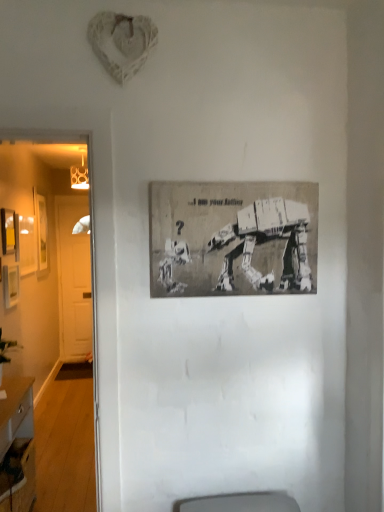
Question: Is gray paper poster at center, the 4th picture frame positioned from the back, at the left side of wooden picture frame at left, arranged as the 4th picture frame when viewed from the right?

Choices:
 (A) yes
 (B) no

Answer: (B)

Question: Is gray paper poster at center, acting as the 1th picture frame starting from the right, oriented towards wooden picture frame at left, marked as the first picture frame in a back-to-front arrangement?

Choices:
 (A) yes
 (B) no

Answer: (B)

Question: Is gray paper poster at center, the 4th picture frame positioned from the back, shorter than wooden picture frame at left, arranged as the 4th picture frame when viewed from the right?

Choices:
 (A) no
 (B) yes

Answer: (B)

Question: Considering the relative sizes of gray paper poster at center, acting as the 1th picture frame starting from the right, and wooden picture frame at left, the first picture frame positioned from the left, in the image provided, is gray paper poster at center, acting as the 1th picture frame starting from the right, thinner than wooden picture frame at left, the first picture frame positioned from the left,?

Choices:
 (A) yes
 (B) no

Answer: (B)

Question: Considering the relative sizes of gray paper poster at center, the 4th picture frame positioned from the back, and wooden picture frame at left, the first picture frame positioned from the left, in the image provided, is gray paper poster at center, the 4th picture frame positioned from the back, smaller than wooden picture frame at left, the first picture frame positioned from the left,?

Choices:
 (A) yes
 (B) no

Answer: (A)

Question: From the image's perspective, is wooden picture frame at left, the 3th picture frame positioned from the front, above or below matte yellow picture frame at left, the 2th picture frame from the left?

Choices:
 (A) above
 (B) below

Answer: (B)

Question: In terms of height, does wooden picture frame at left, the 2th picture frame in the right-to-left sequence, look taller or shorter compared to matte yellow picture frame at left, the 2th picture frame from the left?

Choices:
 (A) tall
 (B) short

Answer: (B)

Question: Is point (14, 288) positioned closer to the camera than point (13, 250)?

Choices:
 (A) farther
 (B) closer

Answer: (B)

Question: Considering the positions of wooden picture frame at left, the 3th picture frame positioned from the front, and matte yellow picture frame at left, which appears as the 2th picture frame when viewed from the front, in the image, is wooden picture frame at left, the 3th picture frame positioned from the front, bigger or smaller than matte yellow picture frame at left, which appears as the 2th picture frame when viewed from the front,?

Choices:
 (A) small
 (B) big

Answer: (A)

Question: Is point (84, 244) closer or farther from the camera than point (8, 425)?

Choices:
 (A) farther
 (B) closer

Answer: (A)

Question: Considering their positions, is white wooden door at left located in front of or behind wooden desk at lower left?

Choices:
 (A) front
 (B) behind

Answer: (B)

Question: From a real-world perspective, relative to wooden desk at lower left, is white wooden door at left vertically above or below?

Choices:
 (A) above
 (B) below

Answer: (A)

Question: Considering the positions of white wooden door at left and wooden desk at lower left in the image, is white wooden door at left taller or shorter than wooden desk at lower left?

Choices:
 (A) tall
 (B) short

Answer: (A)

Question: Looking at their shapes, would you say wooden desk at lower left is wider or thinner than matte yellow picture frame at left, which is the third picture frame in right-to-left order?

Choices:
 (A) wide
 (B) thin

Answer: (A)

Question: Is wooden desk at lower left taller or shorter than matte yellow picture frame at left, which ranks as the 3th picture frame in back-to-front order?

Choices:
 (A) short
 (B) tall

Answer: (B)